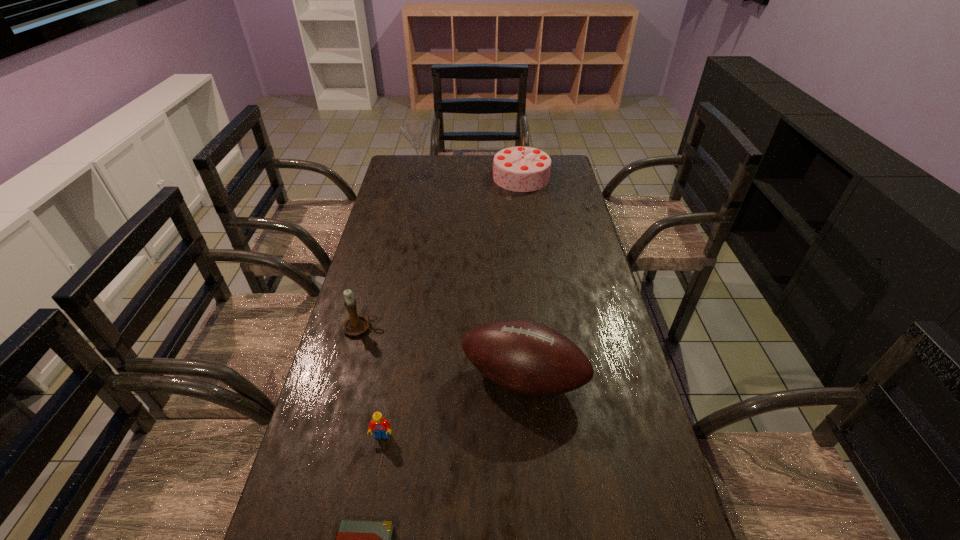
The image size is (960, 540). Identify the location of vacant space positioned on the side of the third shortest object with the handle. (489, 327).

Identify the location of vacant position located on the face of the Lego. This screenshot has height=540, width=960. (373, 486).

You are a GUI agent. You are given a task and a screenshot of the screen. Output one action in this format:
    pyautogui.click(x=<x>, y=<y>)
    Task: Click on the flute glass that is positioned at the far edge
    Image resolution: width=960 pixels, height=540 pixels.
    Given the screenshot: What is the action you would take?
    pyautogui.click(x=416, y=132)

Locate an element on the screen. The height and width of the screenshot is (540, 960). birthday cake at the far edge is located at coordinates (522, 169).

You are a GUI agent. You are given a task and a screenshot of the screen. Output one action in this format:
    pyautogui.click(x=<x>, y=<y>)
    Task: Click on the flute glass positioned at the left edge
    This screenshot has height=540, width=960.
    Given the screenshot: What is the action you would take?
    pyautogui.click(x=416, y=132)

The width and height of the screenshot is (960, 540). Find the location of `candle holder that is at the left edge`. candle holder that is at the left edge is located at coordinates (355, 325).

Identify the location of Lego at the left edge. (381, 427).

The image size is (960, 540). In order to click on birthday cake at the right edge in this screenshot , I will do `click(522, 169)`.

Locate an element on the screen. The height and width of the screenshot is (540, 960). football (American) at the right edge is located at coordinates (526, 357).

Find the location of a particular element. This screenshot has width=960, height=540. object that is at the far left corner is located at coordinates (416, 132).